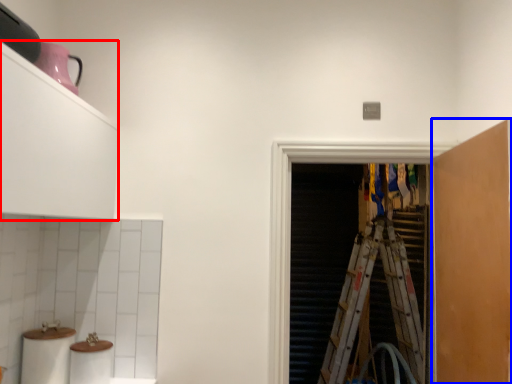
Question: Which point is further to the camera, cabinetry (highlighted by a red box) or cabinetry (highlighted by a blue box)?

Choices:
 (A) cabinetry
 (B) cabinetry

Answer: (B)